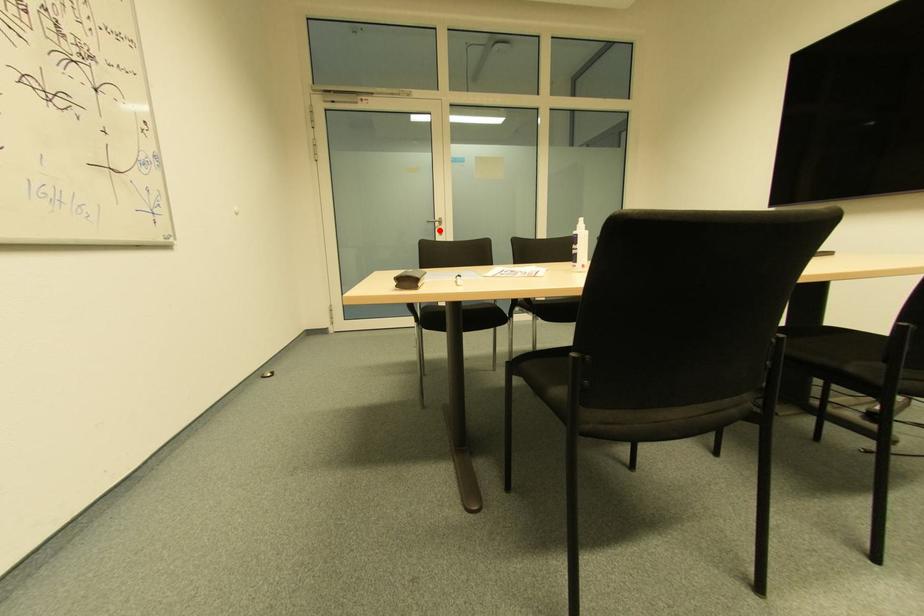
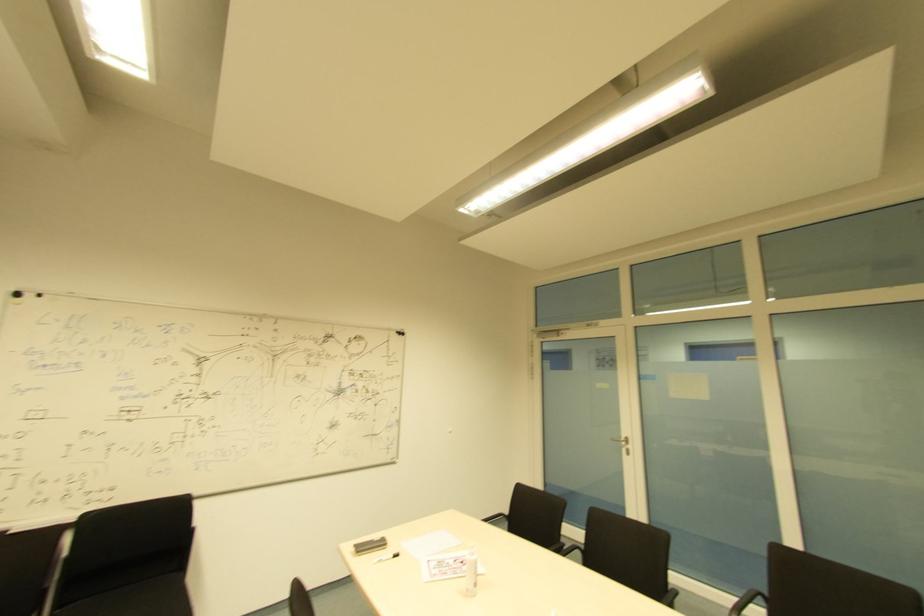
Question: I am providing you with two images of the same scene from different viewpoints. Given a red point in image1, look at the same physical point in image2. Is it:

Choices:
 (A) Closer to the viewpoint
 (B) Farther from the viewpoint

Answer: (B)